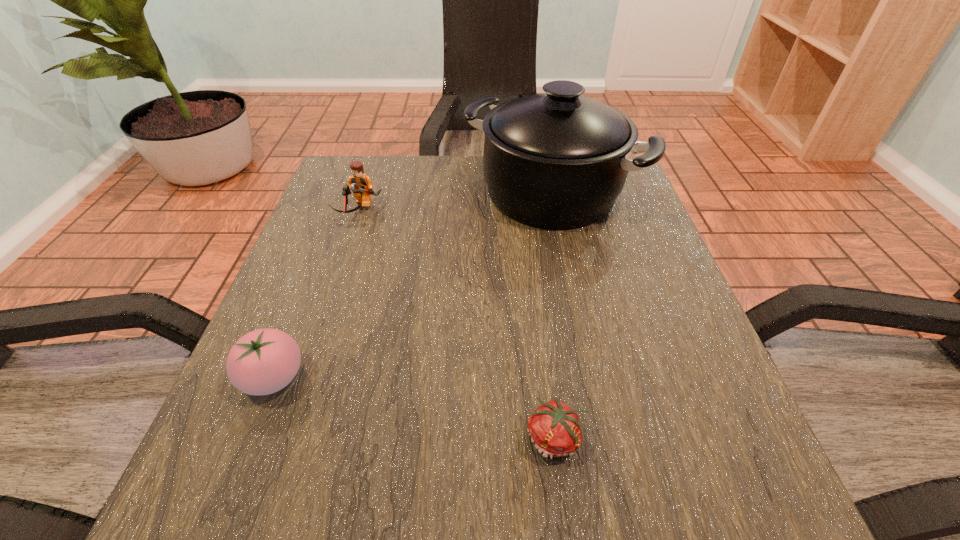
Where is `vacant point that satisfies the following two spatial constraints: 1. on the back side of the tallest object; 2. on the left side of the nearer tomato`? The image size is (960, 540). vacant point that satisfies the following two spatial constraints: 1. on the back side of the tallest object; 2. on the left side of the nearer tomato is located at coordinates point(524,193).